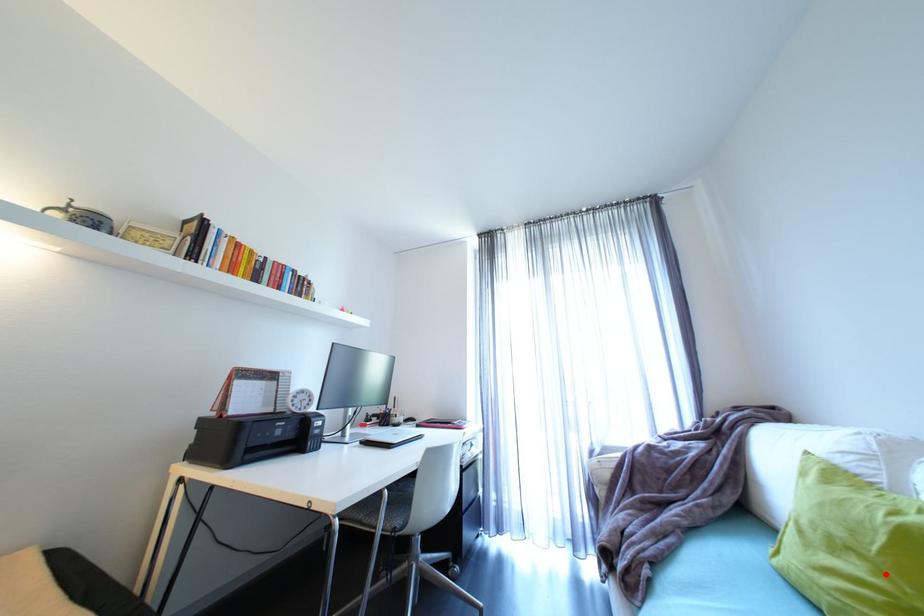
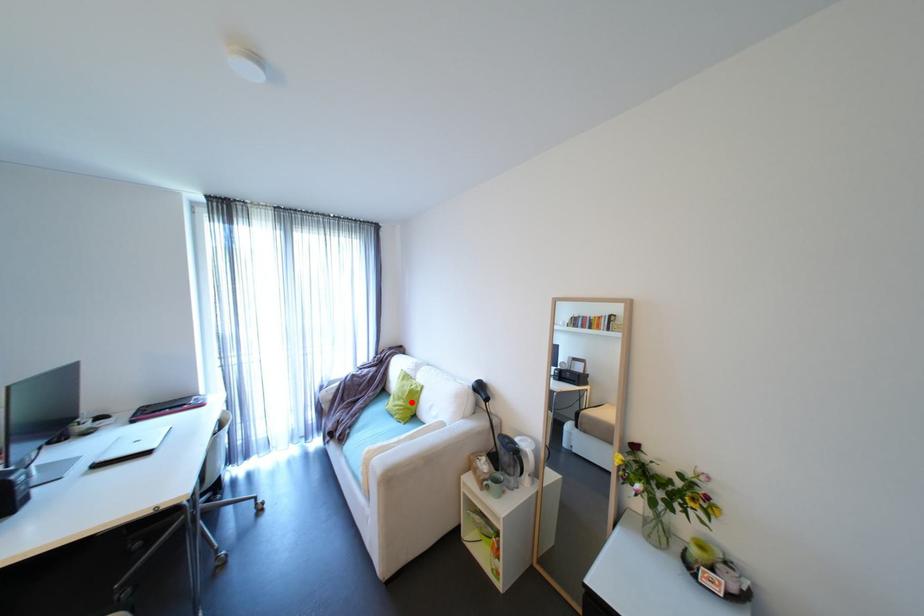
I am providing you with two images of the same scene from different viewpoints. A red point is marked on the first image and another point is marked on the second image. Is the red point in image1 aligned with the point shown in image2?

Yes